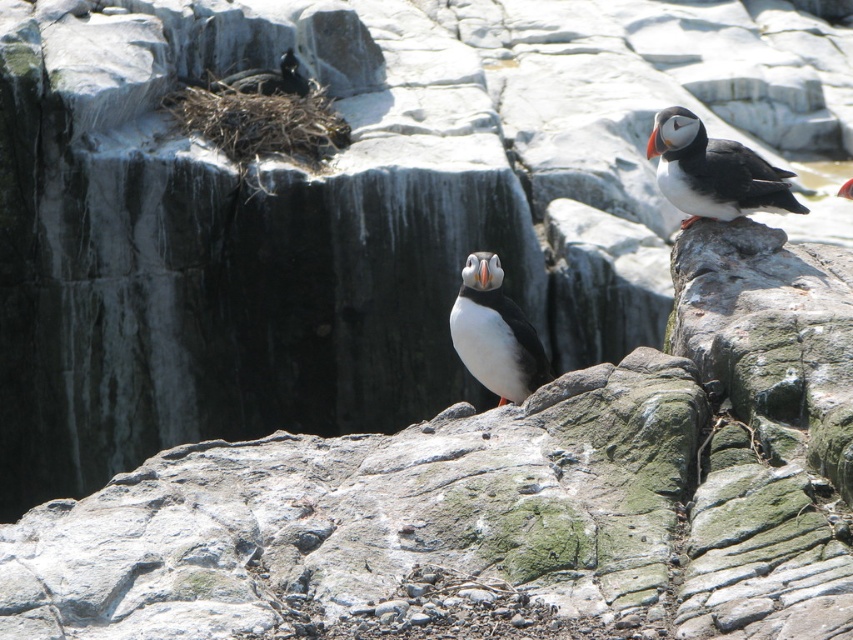
You are a birdwatcher observing the coastal scene. You notice the black matte puffin at right and the white matte puffin at center. Which of these two puffins is positioned lower in the scene?

The black matte puffin at right has a lesser height compared to the white matte puffin at center, so the black matte puffin at right is positioned lower in the scene.

You are a birdwatcher trying to observe the two puffins at the coordinates point (670,202) and point (503,305). Which puffin is closer to you?

The puffin at point (670,202) is closer to you because it is further to the viewer than the puffin at point (503,305).

You are a birdwatcher observing the rocky coastal scene. You notice two puffins labeled as the black matte puffin at right and the white matte puffin at center. Which puffin is closer to you?

The black matte puffin at right is closer to you because the white matte puffin at center is behind it.